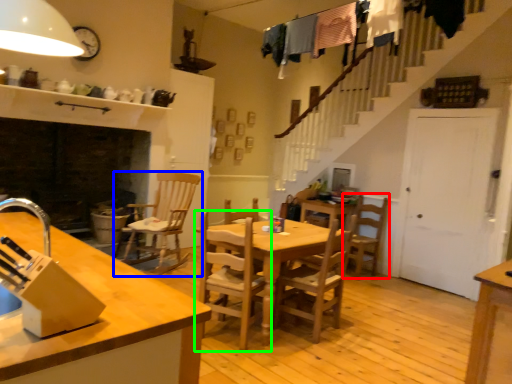
Question: Estimate the real-world distances between objects in this image. Which object is closer to chair (highlighted by a red box), chair (highlighted by a blue box) or chair (highlighted by a green box)?

Choices:
 (A) chair
 (B) chair

Answer: (B)